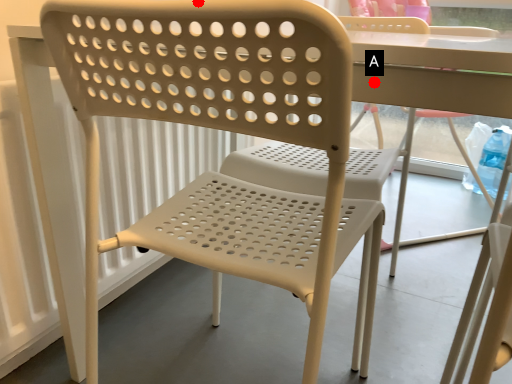
Question: Two points are circled on the image, labeled by A and B beside each circle. Among these points, which one is farthest from the camera?

Choices:
 (A) A is further
 (B) B is further

Answer: (A)